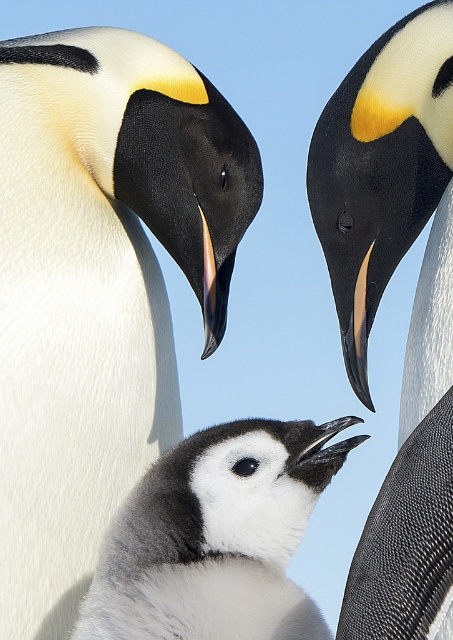
You are a wildlife photographer trying to capture a close shot of the white fluffy penguin chick at center and the soft gray down at center. Which one should you focus on if you want to photograph the bigger subject?

The white fluffy penguin chick at center is larger in size than the soft gray down at center, so you should focus on the white fluffy penguin chick at center for the bigger subject.

You are a photographer trying to capture the white fluffy penguin chick at center. Based on the coordinates provided, where should you aim your camera lens to ensure the chick is centered in your shot?

You should aim your camera lens at the coordinates point (100, 288) to center the white fluffy penguin chick at center in your shot.